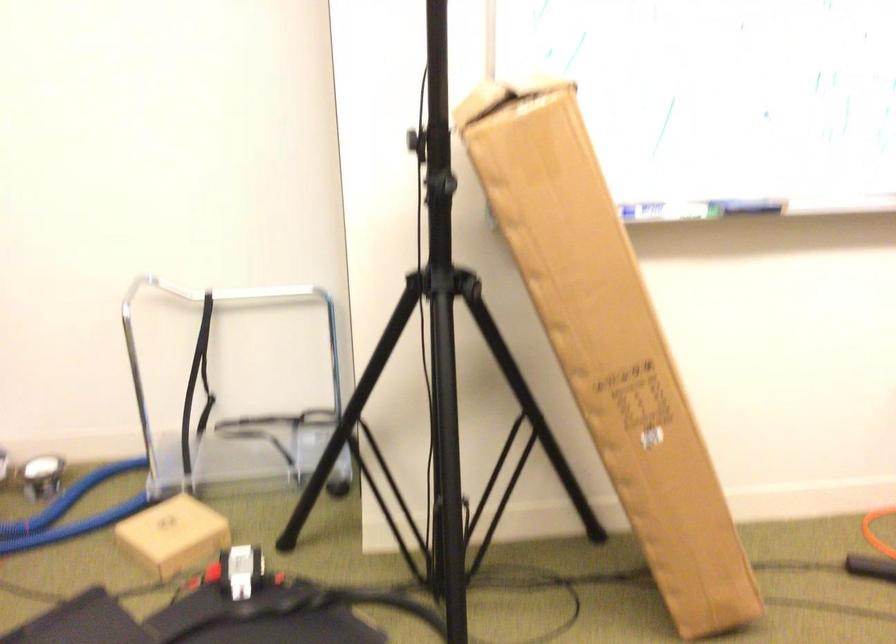
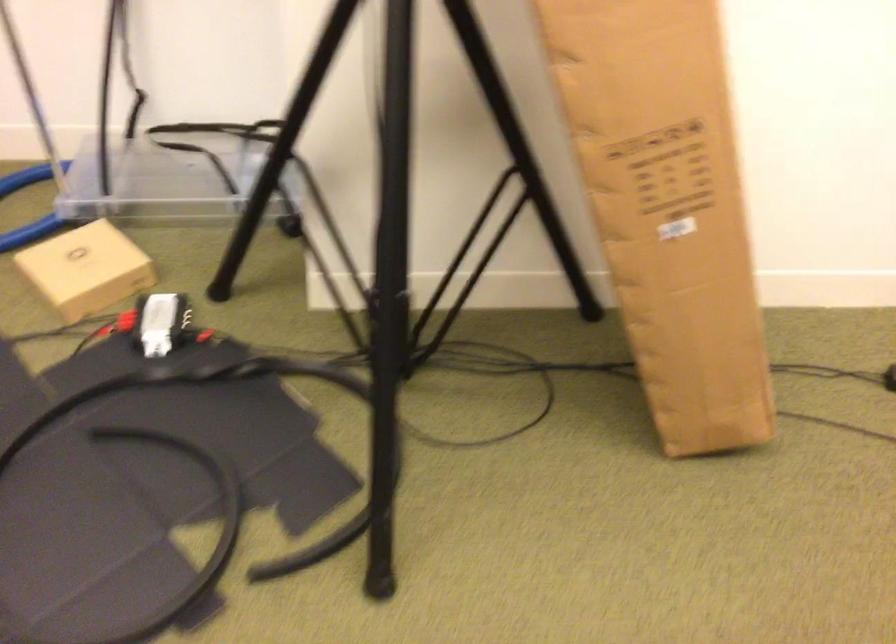
Question: Which direction would the cameraman need to move to produce the second image? Reply with the corresponding letter.

Choices:
 (A) Left
 (B) Right
 (C) Forward
 (D) Backward

Answer: (C)